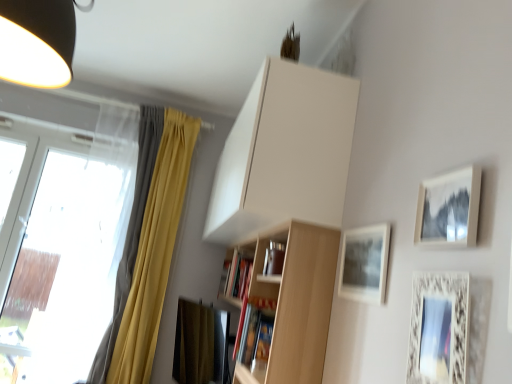
Question: Which direction should I rotate to look at hardcover book at center, which is the first book in back-to-front order?

Choices:
 (A) right
 (B) left

Answer: (B)

Question: Can you confirm if transparent glass window at left is positioned to the left of hardcover book at center, placed as the first book when sorted from front to back?

Choices:
 (A) no
 (B) yes

Answer: (B)

Question: Is transparent glass window at left not within hardcover book at center, the second book when ordered from back to front?

Choices:
 (A) yes
 (B) no

Answer: (A)

Question: Considering the relative sizes of transparent glass window at left and hardcover book at center, placed as the first book when sorted from front to back, in the image provided, is transparent glass window at left taller than hardcover book at center, placed as the first book when sorted from front to back,?

Choices:
 (A) no
 (B) yes

Answer: (B)

Question: Considering the relative sizes of transparent glass window at left and hardcover book at center, the second book when ordered from back to front, in the image provided, is transparent glass window at left bigger than hardcover book at center, the second book when ordered from back to front,?

Choices:
 (A) no
 (B) yes

Answer: (B)

Question: Is transparent glass window at left positioned with its back to hardcover book at center, the second book when ordered from back to front?

Choices:
 (A) no
 (B) yes

Answer: (A)

Question: Considering the relative sizes of transparent glass window at left and hardcover book at center, the second book when ordered from back to front, in the image provided, is transparent glass window at left thinner than hardcover book at center, the second book when ordered from back to front,?

Choices:
 (A) no
 (B) yes

Answer: (A)

Question: Is the position of hardcover book at center, the second book when ordered from back to front, less distant than that of white matte cabinet at upper center?

Choices:
 (A) yes
 (B) no

Answer: (B)

Question: Could white matte cabinet at upper center be considered to be inside hardcover book at center, placed as the first book when sorted from front to back?

Choices:
 (A) no
 (B) yes

Answer: (A)

Question: Does hardcover book at center, the second book when ordered from back to front, have a greater width compared to white matte cabinet at upper center?

Choices:
 (A) no
 (B) yes

Answer: (A)

Question: Considering the relative sizes of hardcover book at center, the second book when ordered from back to front, and white matte cabinet at upper center in the image provided, is hardcover book at center, the second book when ordered from back to front, smaller than white matte cabinet at upper center?

Choices:
 (A) yes
 (B) no

Answer: (A)

Question: From the image's perspective, is hardcover book at center, placed as the first book when sorted from front to back, over white matte cabinet at upper center?

Choices:
 (A) yes
 (B) no

Answer: (B)

Question: Can you confirm if hardcover book at center, the second book when ordered from back to front, is bigger than white matte cabinet at upper center?

Choices:
 (A) no
 (B) yes

Answer: (A)

Question: Is white matte cabinet at upper center at the right side of matte white picture frame at upper right, the 2th picture frame when ordered from back to front?

Choices:
 (A) no
 (B) yes

Answer: (A)